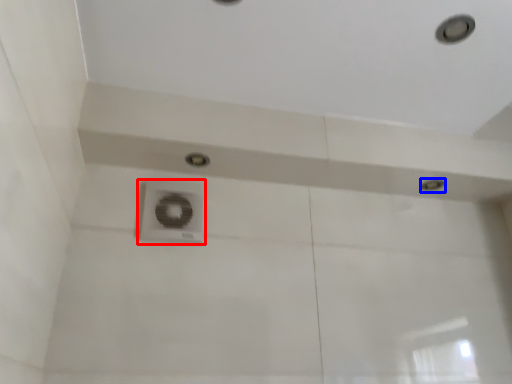
Question: Which object is closer to the camera taking this photo, plumbing fixture (highlighted by a red box) or droplight (highlighted by a blue box)?

Choices:
 (A) plumbing fixture
 (B) droplight

Answer: (A)